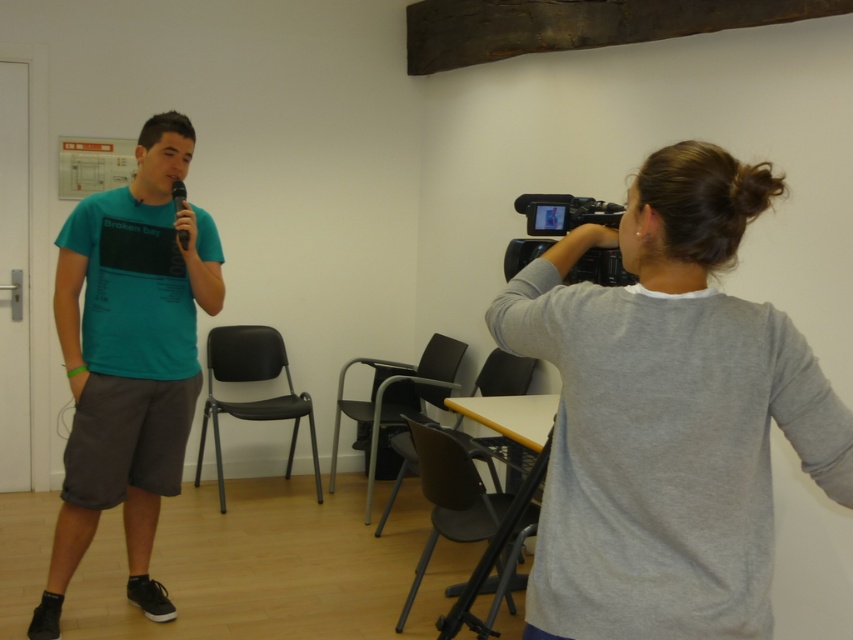
Question: Observing the image, what is the correct spatial positioning of black plastic video camera at center in reference to black matte microphone at left?

Choices:
 (A) right
 (B) left

Answer: (A)

Question: Which point is closer to the camera taking this photo?

Choices:
 (A) (635, 492)
 (B) (553, 218)

Answer: (A)

Question: Which point is closer to the camera?

Choices:
 (A) (544, 470)
 (B) (187, 218)

Answer: (A)

Question: Does teal fabric shirt at left have a greater width compared to black plastic tripod at lower center?

Choices:
 (A) no
 (B) yes

Answer: (B)

Question: Observing the image, what is the correct spatial positioning of black plastic video camera at center in reference to black plastic tripod at lower center?

Choices:
 (A) right
 (B) left

Answer: (A)

Question: Which of the following is the closest to the observer?

Choices:
 (A) gray matte shirt at upper right
 (B) black plastic tripod at lower center
 (C) black matte microphone at left

Answer: (A)